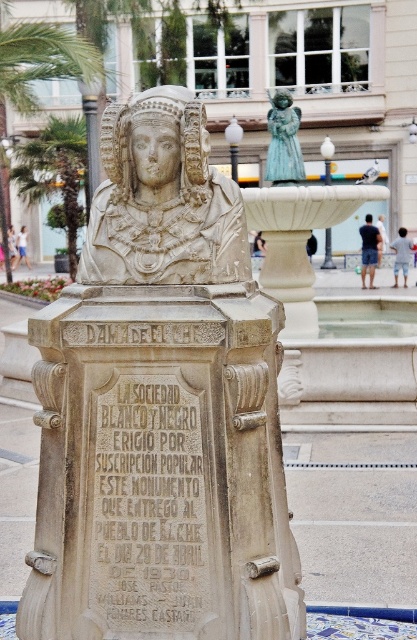
In the scene shown: Is stone inscription at center below green leafy palm tree at left?

Indeed, stone inscription at center is positioned under green leafy palm tree at left.

Based on the photo, can you confirm if stone inscription at center is bigger than green leafy palm tree at left?

No.

Is point (115, 634) positioned after point (63, 214)?

No, (115, 634) is closer to viewer.

Where is `stone inscription at center`? stone inscription at center is located at coordinates (148, 509).

Can you confirm if stone inscription at center is bigger than green leafy palm tree at upper left?

Actually, stone inscription at center might be smaller than green leafy palm tree at upper left.

At what (x,y) coordinates should I click in order to perform the action: click on stone inscription at center. Please return your answer as a coordinate pair (x, y). The height and width of the screenshot is (640, 417). Looking at the image, I should click on (148, 509).

Describe the element at coordinates (148, 509) in the screenshot. I see `stone inscription at center` at that location.

At what (x,y) coordinates should I click in order to perform the action: click on stone inscription at center. Please return your answer as a coordinate pair (x, y). The height and width of the screenshot is (640, 417). Looking at the image, I should click on (148, 509).

Who is positioned more to the right, beige stone bust at center or green patina statue at center?

From the viewer's perspective, green patina statue at center appears more on the right side.

Does beige stone bust at center appear on the left side of green patina statue at center?

Yes, beige stone bust at center is to the left of green patina statue at center.

Between point (183, 161) and point (276, 112), which one is positioned behind?

Point (276, 112)

Where is `beige stone bust at center`? This screenshot has width=417, height=640. beige stone bust at center is located at coordinates (160, 410).